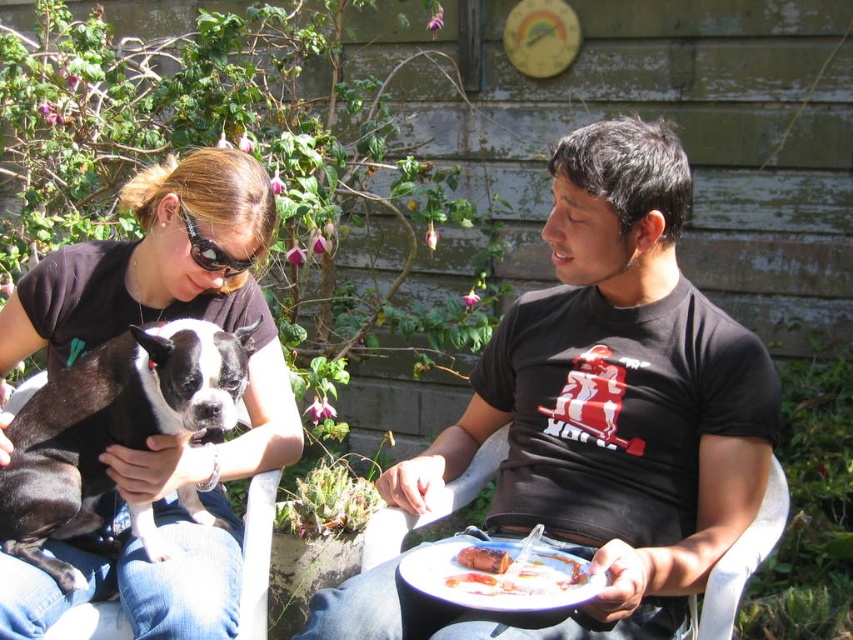
Does matte black t-shirt at upper left have a lesser width compared to white plastic chair at lower center?

Incorrect, matte black t-shirt at upper left's width is not less than white plastic chair at lower center's.

At what (x,y) coordinates should I click in order to perform the action: click on matte black t-shirt at upper left. Please return your answer as a coordinate pair (x, y). This screenshot has width=853, height=640. Looking at the image, I should click on (160, 435).

Is point (231, 516) positioned before point (712, 620)?

No, (231, 516) is further to viewer.

Where is `matte black t-shirt at upper left`? matte black t-shirt at upper left is located at coordinates (160, 435).

Is black plastic goggles at upper center shorter than smooth brown bread at lower center?

In fact, black plastic goggles at upper center may be taller than smooth brown bread at lower center.

Does black plastic goggles at upper center lie in front of smooth brown bread at lower center?

No, black plastic goggles at upper center is further to the viewer.

Locate an element on the screen. Image resolution: width=853 pixels, height=640 pixels. black plastic goggles at upper center is located at coordinates (212, 250).

Which of these two, matte black t-shirt at upper left or smooth brown bread at lower center, stands taller?

With more height is matte black t-shirt at upper left.

Who is more forward, (119, 472) or (492, 564)?

Point (492, 564) is in front.

Locate an element on the screen. The width and height of the screenshot is (853, 640). matte black t-shirt at upper left is located at coordinates (160, 435).